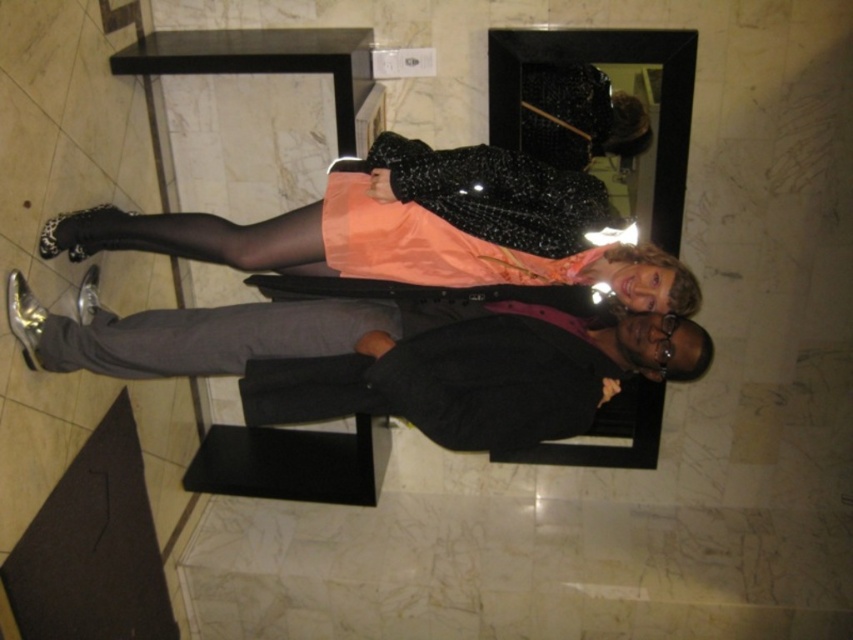
Consider the image. Who is shorter, matte black suit at center or matte orange dress at center?

With less height is matte orange dress at center.

The image size is (853, 640). Describe the element at coordinates (387, 360) in the screenshot. I see `matte black suit at center` at that location.

Does point (132, 337) come behind point (440, 195)?

Yes, point (132, 337) is farther from viewer.

Identify the location of matte black suit at center. (387, 360).

Looking at this image, who is positioned more to the left, matte orange dress at center or gray smooth pants at lower center?

From the viewer's perspective, gray smooth pants at lower center appears more on the left side.

Is matte orange dress at center below gray smooth pants at lower center?

No, matte orange dress at center is not below gray smooth pants at lower center.

Is point (485, 198) positioned in front of point (264, 317)?

No.

Where is `matte orange dress at center`? This screenshot has width=853, height=640. matte orange dress at center is located at coordinates click(x=459, y=216).

Is matte black suit at center thinner than gray smooth pants at lower center?

Incorrect, matte black suit at center's width is not less than gray smooth pants at lower center's.

Does matte black suit at center have a lesser height compared to gray smooth pants at lower center?

No.

Consider the image. Measure the distance between point (368, 328) and camera.

They are 6.60 feet apart.

The height and width of the screenshot is (640, 853). Find the location of `matte black suit at center`. matte black suit at center is located at coordinates (387, 360).